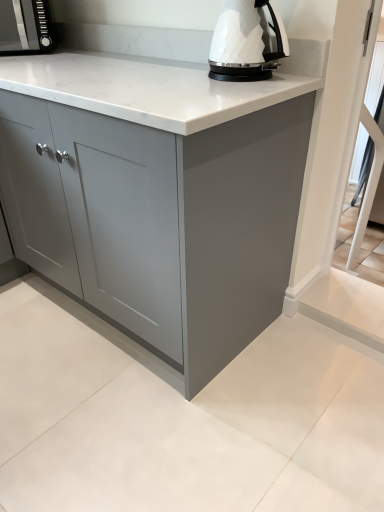
Question: Does matte black microwave at upper left lie behind matte gray cabinet at center?

Choices:
 (A) no
 (B) yes

Answer: (B)

Question: Is matte black microwave at upper left at the left side of matte gray cabinet at center?

Choices:
 (A) yes
 (B) no

Answer: (A)

Question: From a real-world perspective, is matte black microwave at upper left located beneath matte gray cabinet at center?

Choices:
 (A) no
 (B) yes

Answer: (A)

Question: Is matte black microwave at upper left looking in the opposite direction of matte gray cabinet at center?

Choices:
 (A) yes
 (B) no

Answer: (A)

Question: Can you confirm if matte black microwave at upper left is smaller than matte gray cabinet at center?

Choices:
 (A) yes
 (B) no

Answer: (A)

Question: From their relative heights in the image, would you say matte gray cabinet at center is taller or shorter than white glossy electric kettle at upper center?

Choices:
 (A) short
 (B) tall

Answer: (B)

Question: From the image's perspective, is matte gray cabinet at center above or below white glossy electric kettle at upper center?

Choices:
 (A) above
 (B) below

Answer: (B)

Question: In terms of width, does matte gray cabinet at center look wider or thinner when compared to white glossy electric kettle at upper center?

Choices:
 (A) wide
 (B) thin

Answer: (A)

Question: Considering their positions, is matte gray cabinet at center located in front of or behind white glossy electric kettle at upper center?

Choices:
 (A) front
 (B) behind

Answer: (A)

Question: Considering the positions of white glossy electric kettle at upper center and matte gray cabinet at center in the image, is white glossy electric kettle at upper center taller or shorter than matte gray cabinet at center?

Choices:
 (A) tall
 (B) short

Answer: (B)

Question: Visually, is white glossy electric kettle at upper center positioned to the left or to the right of matte gray cabinet at center?

Choices:
 (A) right
 (B) left

Answer: (A)

Question: Is white glossy electric kettle at upper center bigger or smaller than matte gray cabinet at center?

Choices:
 (A) small
 (B) big

Answer: (A)

Question: Looking at their shapes, would you say white glossy electric kettle at upper center is wider or thinner than matte gray cabinet at center?

Choices:
 (A) thin
 (B) wide

Answer: (A)

Question: Considering the positions of point (8, 2) and point (263, 29), is point (8, 2) closer or farther from the camera than point (263, 29)?

Choices:
 (A) farther
 (B) closer

Answer: (A)

Question: Based on their sizes in the image, would you say matte black microwave at upper left is bigger or smaller than white glossy electric kettle at upper center?

Choices:
 (A) big
 (B) small

Answer: (A)